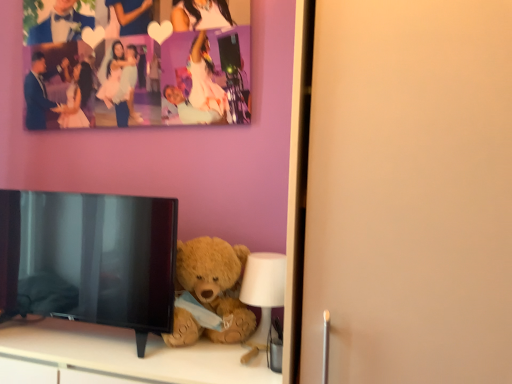
I want to click on vacant space underneath fuzzy brown teddy bear at lower center (from a real-world perspective), so click(x=207, y=344).